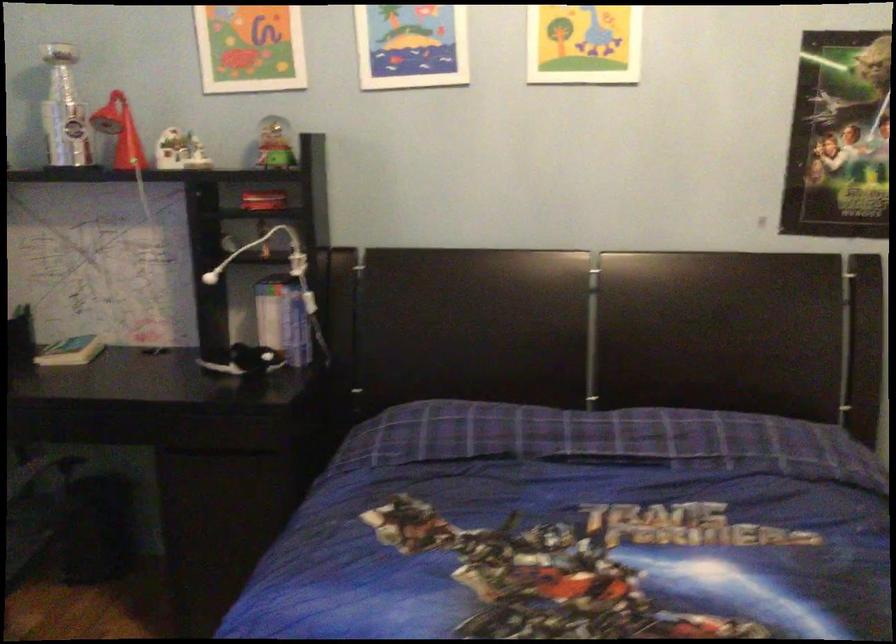
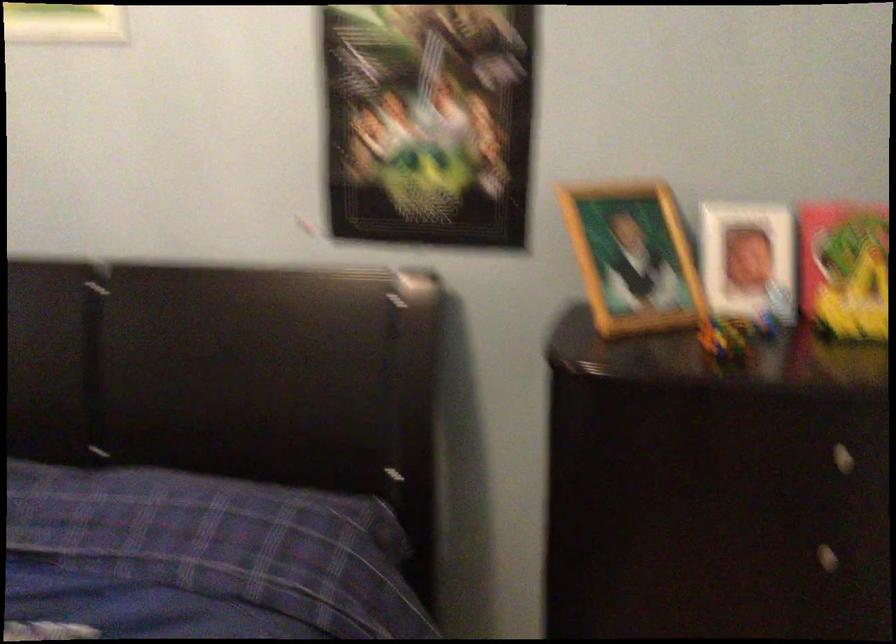
In a continuous first-person perspective shot, in which direction is the camera moving?

Result: The cameraman walked toward right, forward.